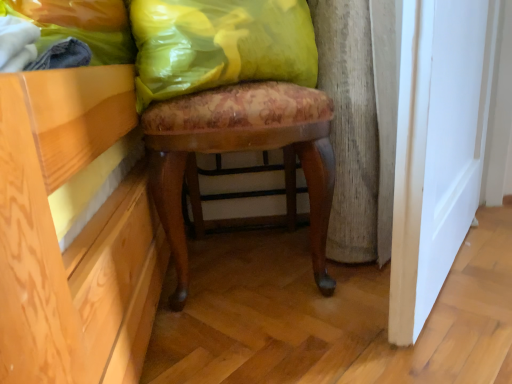
You are a GUI agent. You are given a task and a screenshot of the screen. Output one action in this format:
    pyautogui.click(x=<x>, y=<y>)
    Task: Click on the vacant space underneath floral fabric stool at center (from a real-world perspective)
    The image size is (512, 384).
    Given the screenshot: What is the action you would take?
    pyautogui.click(x=264, y=275)